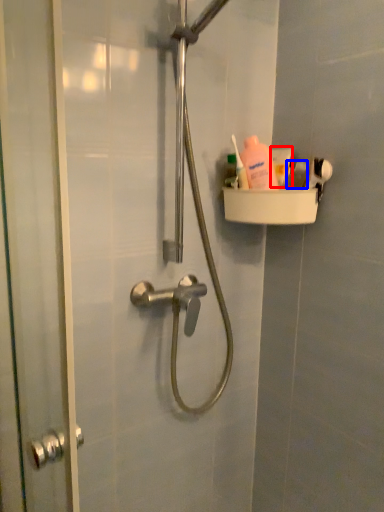
Question: Which object appears farthest to the camera in this image, toothpaste (highlighted by a red box) or toiletry (highlighted by a blue box)?

Choices:
 (A) toothpaste
 (B) toiletry

Answer: (A)